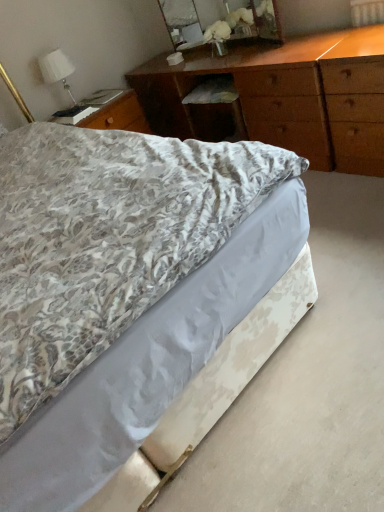
Question: Would you say wooden mirror at upper center is to the left or to the right of white fabric lampshade at upper left in the picture?

Choices:
 (A) right
 (B) left

Answer: (A)

Question: Based on their sizes in the image, would you say wooden mirror at upper center is bigger or smaller than white fabric lampshade at upper left?

Choices:
 (A) big
 (B) small

Answer: (A)

Question: Which object is the farthest from the wooden chest of drawers at upper center?

Choices:
 (A) floral-patterned fabric bed at center
 (B) wooden mirror at upper center
 (C) white fabric lampshade at upper left

Answer: (A)

Question: Which object is the farthest from the wooden chest of drawers at upper center?

Choices:
 (A) white fabric lampshade at upper left
 (B) wooden mirror at upper center
 (C) floral-patterned fabric bed at center

Answer: (C)